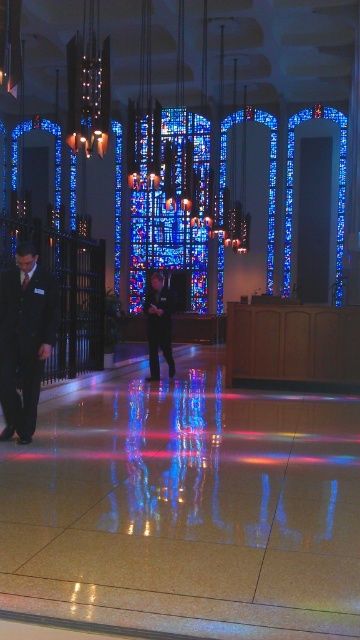
From the picture: You are a photographer preparing for an event at the church. You need to position two identical cameras to capture both dark blue suits. Since the dark blue suit at left is smaller than the dark blue suit at center, which camera should you place closer to the subject to ensure they appear the same size in photos?

The dark blue suit at left has a smaller size compared to dark blue suit at center. To make them appear the same size in photos, the camera positioned for the dark blue suit at left should be placed closer to it than the one for the dark blue suit at center.

You are a photographer standing at the entrance of the church. You want to take a picture of both the dark blue suit at left and the dark blue suit at center in the same frame. Given that your camera has a maximum focal length that allows capturing objects up to 5 meters apart in the frame, will you be able to include both suits in your photo?

The dark blue suit at left and dark blue suit at center are 4.50 meters apart from each other, which is within the camera maximum focal length of 5 meters. Therefore, you can include both suits in the same frame.

You are an event planner arranging seating for a wedding. You have two dark blue suits available for the ushers. The dark blue suit at left and the dark blue suit at center. Which one should you choose if you need a wider suit to accommodate a larger usher?

The dark blue suit at left is wider than the dark blue suit at center, so you should choose the dark blue suit at left to accommodate a larger usher.